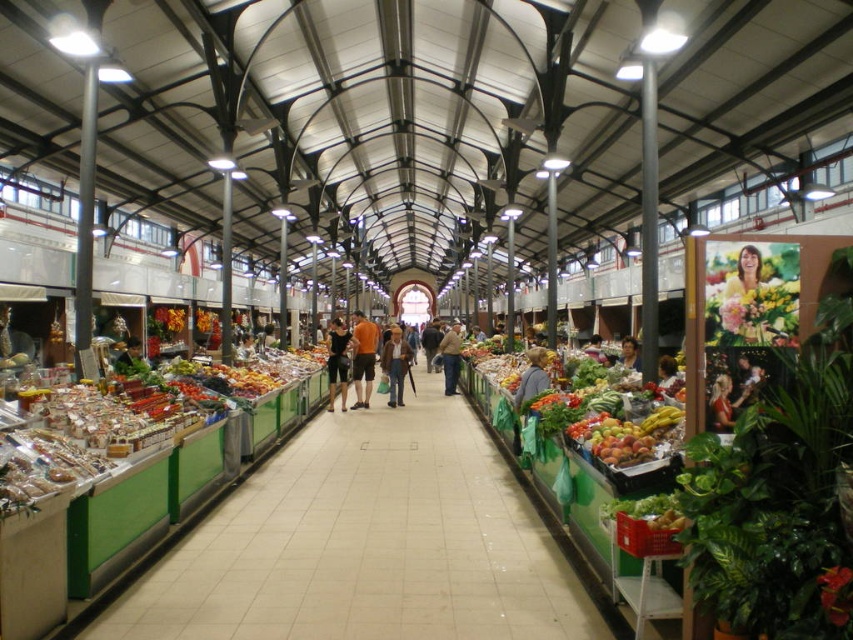
Between point (355, 397) and point (393, 349), which one is positioned behind?

Point (355, 397)

Does orange cotton t-shirt at center have a greater width compared to brown leather jacket at center?

Indeed, orange cotton t-shirt at center has a greater width compared to brown leather jacket at center.

Describe the element at coordinates (363, 356) in the screenshot. I see `orange cotton t-shirt at center` at that location.

This screenshot has width=853, height=640. In order to click on orange cotton t-shirt at center in this screenshot , I will do `click(363, 356)`.

Is denim jacket at center taller than smooth brown hair at center?

Indeed, denim jacket at center has a greater height compared to smooth brown hair at center.

Who is more distant from viewer, (450, 392) or (628, 339)?

The point (450, 392) is behind.

Locate an element on the screen. Image resolution: width=853 pixels, height=640 pixels. denim jacket at center is located at coordinates (450, 356).

Does orange cotton t-shirt at center have a greater width compared to smooth brown hair at center?

Yes, orange cotton t-shirt at center is wider than smooth brown hair at center.

Between orange cotton t-shirt at center and smooth brown hair at center, which one has less height?

smooth brown hair at center is shorter.

Who is more forward, (373, 333) or (622, 342)?

Point (622, 342)

At what (x,y) coordinates should I click in order to perform the action: click on orange cotton t-shirt at center. Please return your answer as a coordinate pair (x, y). The width and height of the screenshot is (853, 640). Looking at the image, I should click on (363, 356).